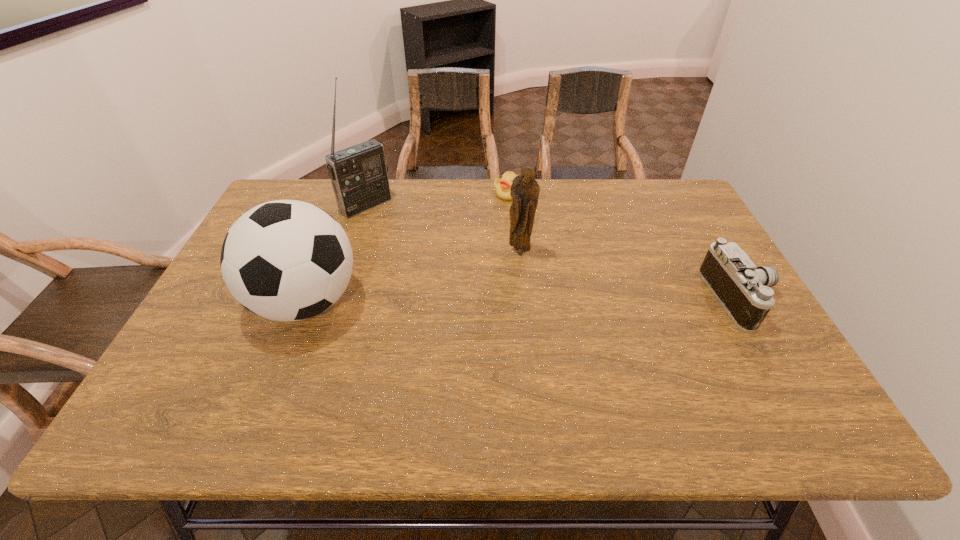
Find the location of a particular element. vacant space at the far edge is located at coordinates (500, 208).

This screenshot has height=540, width=960. Find the location of `vacant space at the near edge`. vacant space at the near edge is located at coordinates (396, 384).

Find the location of a particular element. vacant area at the left edge of the desktop is located at coordinates (190, 353).

In order to click on vacant region at the right edge of the desktop in this screenshot , I will do `click(745, 336)`.

I want to click on vacant space at the far right corner, so click(637, 194).

Locate an element on the screen. The width and height of the screenshot is (960, 540). blank region between the soccer ball and the second shortest object is located at coordinates coord(523,300).

Locate an element on the screen. vacant space in between the figurine and the camera is located at coordinates (630, 276).

The image size is (960, 540). Find the location of `blank region between the soccer ball and the rightmost object`. blank region between the soccer ball and the rightmost object is located at coordinates (523, 300).

Find the location of `empty location between the camera and the duckling`. empty location between the camera and the duckling is located at coordinates (625, 246).

The width and height of the screenshot is (960, 540). In order to click on free spot between the soccer ball and the third nearest object in this screenshot , I will do `click(413, 278)`.